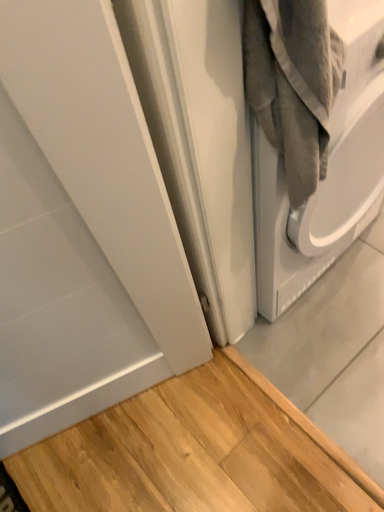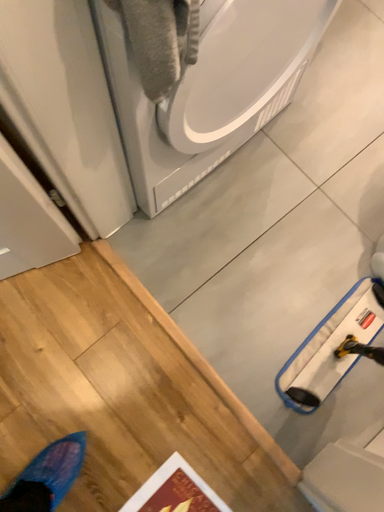
Question: How did the camera likely rotate when shooting the video?

Choices:
 (A) rotated left
 (B) rotated right

Answer: (B)